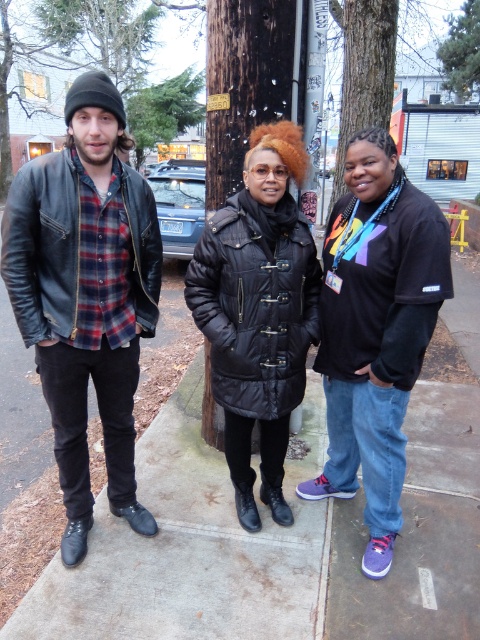
Between leather jacket at left and black matte t-shirt at center, which one appears on the right side from the viewer's perspective?

black matte t-shirt at center

Who is more forward, (x=110, y=84) or (x=355, y=211)?

Point (x=110, y=84) is in front.

This screenshot has width=480, height=640. Find the location of `leather jacket at left`. leather jacket at left is located at coordinates (85, 294).

What do you see at coordinates (85, 294) in the screenshot? This screenshot has width=480, height=640. I see `leather jacket at left` at bounding box center [85, 294].

Is leather jacket at left taller than black quilted coat at center?

Yes, leather jacket at left is taller than black quilted coat at center.

Image resolution: width=480 pixels, height=640 pixels. In order to click on leather jacket at left in this screenshot , I will do `click(85, 294)`.

Identify the location of leather jacket at left. (85, 294).

Can you confirm if black matte t-shirt at center is shorter than black quilted coat at center?

Correct, black matte t-shirt at center is not as tall as black quilted coat at center.

Can you confirm if black matte t-shirt at center is taller than black quilted coat at center?

In fact, black matte t-shirt at center may be shorter than black quilted coat at center.

Measure the distance between point (333, 330) and camera.

A distance of 2.39 meters exists between point (333, 330) and camera.

Locate an element on the screen. black matte t-shirt at center is located at coordinates (375, 330).